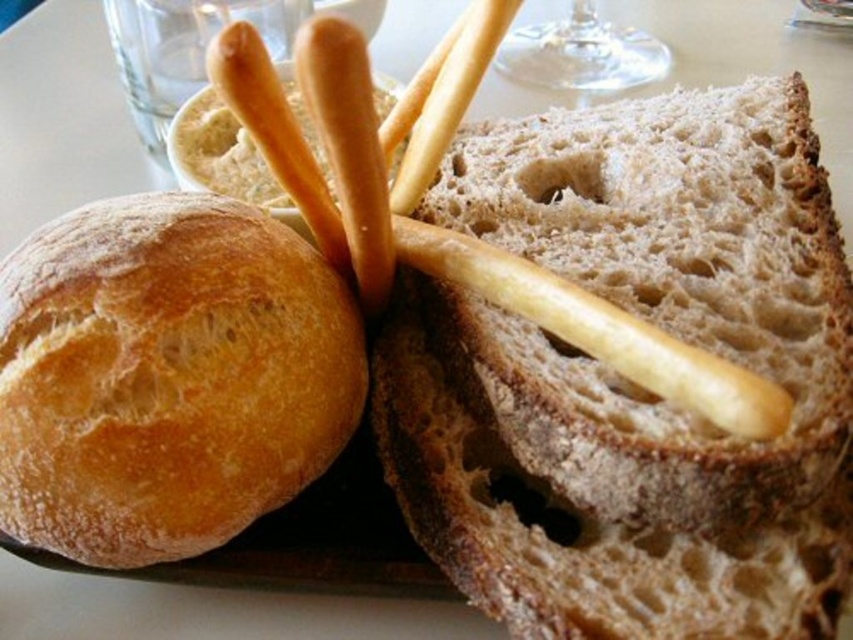
Who is more forward, (x=489, y=147) or (x=250, y=250)?

Point (x=250, y=250)

Who is positioned more to the left, brown crusty bread at center or golden brown crusty bread at left?

golden brown crusty bread at left

Does point (780, 627) lie in front of point (328, 433)?

Yes.

Image resolution: width=853 pixels, height=640 pixels. Find the location of `brown crusty bread at center`. brown crusty bread at center is located at coordinates (630, 381).

Can you confirm if brown crusty bread at center is wider than transparent glass wine glass at upper center?

Indeed, brown crusty bread at center has a greater width compared to transparent glass wine glass at upper center.

In the scene shown: Is brown crusty bread at center to the left of transparent glass wine glass at upper center from the viewer's perspective?

Indeed, brown crusty bread at center is positioned on the left side of transparent glass wine glass at upper center.

Is point (666, 624) positioned before point (606, 84)?

Yes.

Locate an element on the screen. The height and width of the screenshot is (640, 853). brown crusty bread at center is located at coordinates pos(630,381).

Is golden brown crusty bread at left closer to camera compared to transparent glass wine glass at upper center?

Yes, it is in front of transparent glass wine glass at upper center.

Image resolution: width=853 pixels, height=640 pixels. What do you see at coordinates (167, 376) in the screenshot?
I see `golden brown crusty bread at left` at bounding box center [167, 376].

I want to click on golden brown crusty bread at left, so click(167, 376).

Where is `golden brown crusty bread at left`? The width and height of the screenshot is (853, 640). golden brown crusty bread at left is located at coordinates (167, 376).